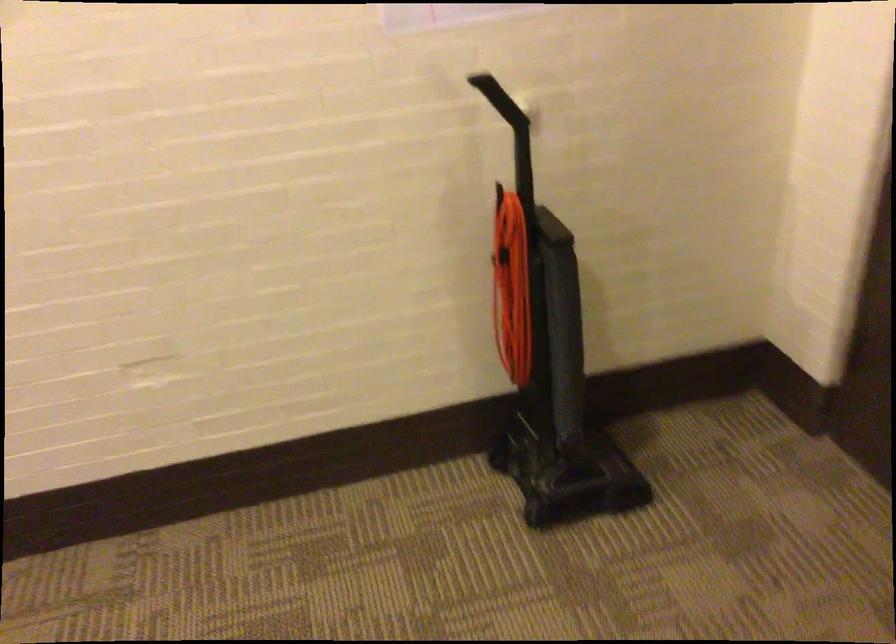
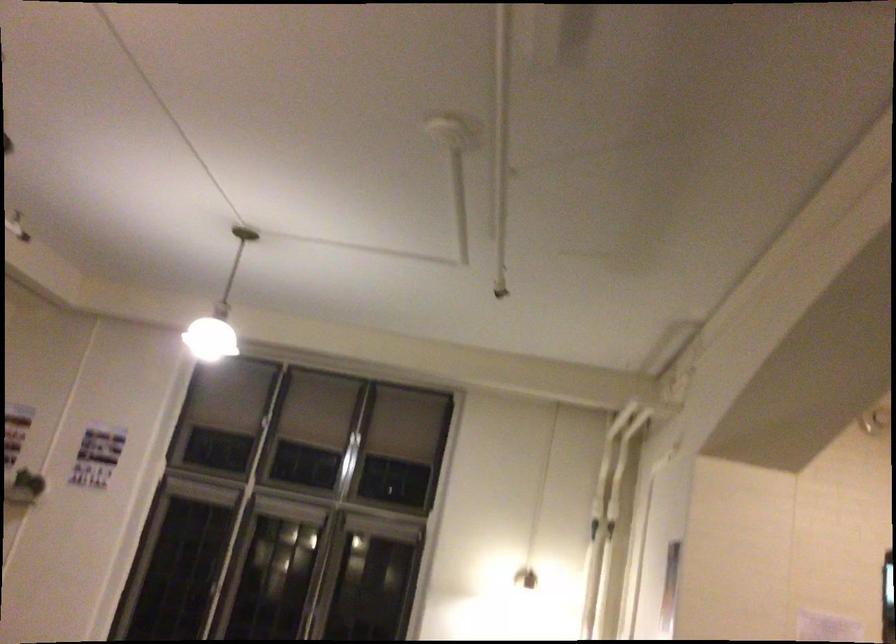
Question: Based on the continuous images, in which direction is the camera rotating? Reply with the corresponding letter.

Choices:
 (A) Left
 (B) Right
 (C) Up
 (D) Down

Answer: (A)